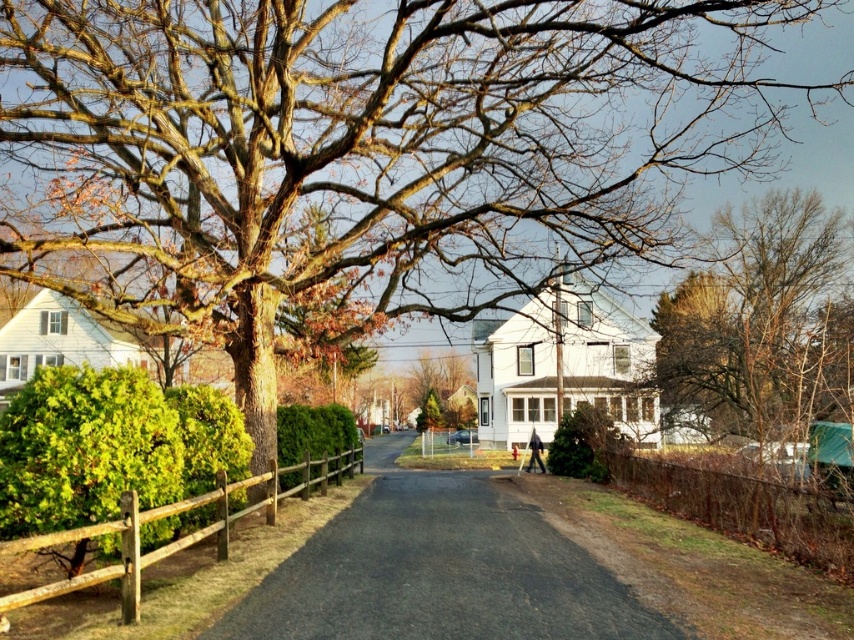
You are a landscape architect designing a pathway that must pass between the brown wooden fence at right and the green matte hedge at center. Based on the scene, which object should the pathway be placed below to ensure it aligns with their vertical positions?

The pathway should be placed below the green matte hedge at center because the brown wooden fence at right is above it, so placing the pathway below the hedge ensures alignment with their vertical positions.

You are a painter who wants to paint the brown wooden fence at right and green textured hedge at center in the scene. Which one should you paint first if you want to start with the shorter object?

The brown wooden fence at right is shorter than the green textured hedge at center, so you should paint the brown wooden fence at right first.